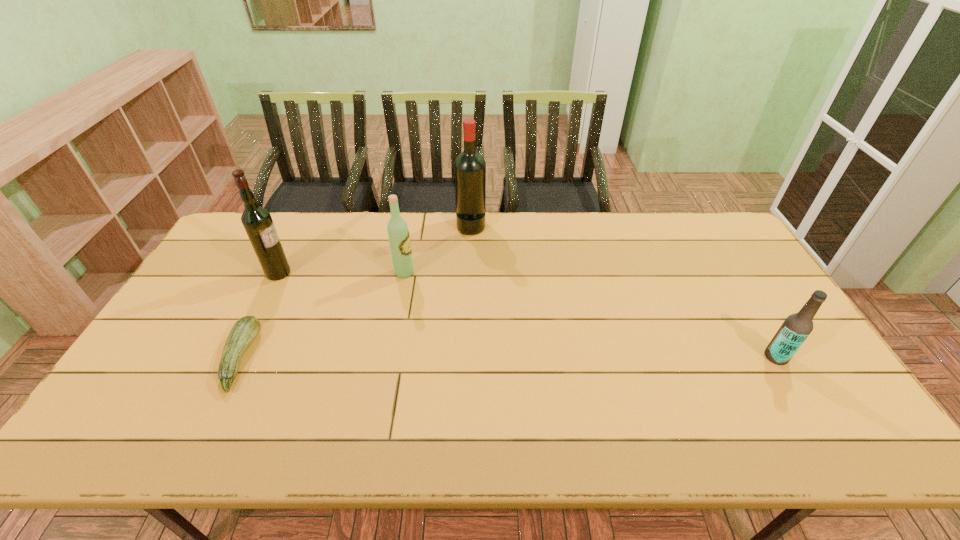
Locate an element on the screen. This screenshot has height=540, width=960. empty space between the farthest wine bottle and the second shortest object is located at coordinates (624, 291).

Where is `vacant region between the shortest object and the second shortest object`? The height and width of the screenshot is (540, 960). vacant region between the shortest object and the second shortest object is located at coordinates (508, 357).

Point out which object is positioned as the second nearest to the leftmost wine bottle. Please provide its 2D coordinates. Your answer should be formatted as a tuple, i.e. [(x, y)], where the tuple contains the x and y coordinates of a point satisfying the conditions above.

[(398, 233)]

Identify the location of object that stands as the fourth closest to the rightmost wine bottle. This screenshot has width=960, height=540. (795, 329).

Choose which wine bottle is the second nearest neighbor to the third object from right to left. Please provide its 2D coordinates. Your answer should be formatted as a tuple, i.e. [(x, y)], where the tuple contains the x and y coordinates of a point satisfying the conditions above.

[(257, 221)]

This screenshot has width=960, height=540. Find the location of `wine bottle that is the nearest to the leftmost wine bottle`. wine bottle that is the nearest to the leftmost wine bottle is located at coordinates (398, 233).

The width and height of the screenshot is (960, 540). Identify the location of vacant region that satisfies the following two spatial constraints: 1. on the front side of the rightmost wine bottle; 2. on the front-facing side of the third object from right to left. [469, 273].